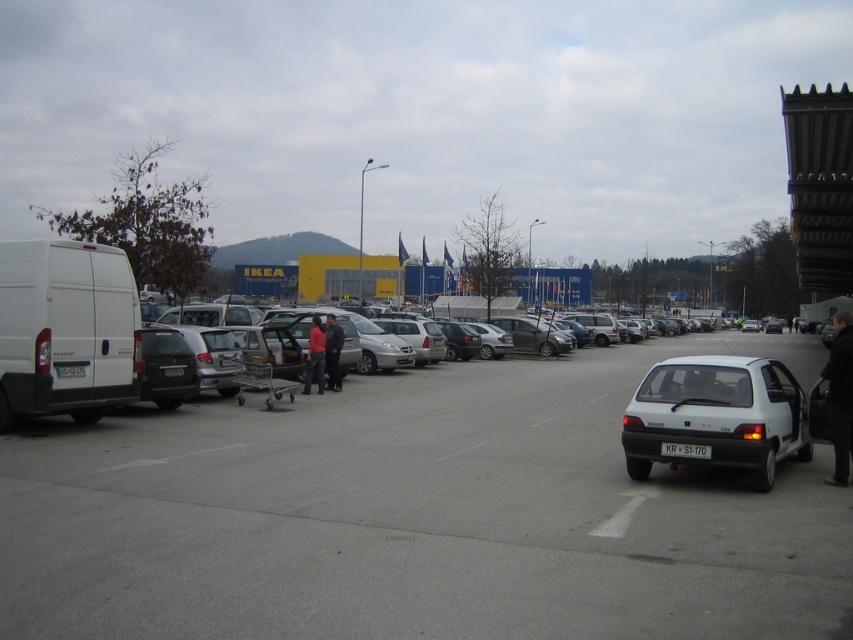
Question: Which is farther from the white matte hatchback at lower right?

Choices:
 (A) black leather jacket at lower right
 (B) pink fabric jacket at center
 (C) white matte car at center
 (D) red jacket at center

Answer: (D)

Question: Which object appears closest to the camera in this image?

Choices:
 (A) pink fabric jacket at center
 (B) red jacket at center

Answer: (A)

Question: Which of these objects is positioned closest to the white matte car at center?

Choices:
 (A) pink fabric jacket at center
 (B) red jacket at center

Answer: (B)

Question: Is white matte car at center below white matte van at left?

Choices:
 (A) no
 (B) yes

Answer: (B)

Question: Does pink fabric jacket at center appear on the right side of red jacket at center?

Choices:
 (A) yes
 (B) no

Answer: (B)

Question: Can you confirm if pink fabric jacket at center is positioned below red jacket at center?

Choices:
 (A) no
 (B) yes

Answer: (A)